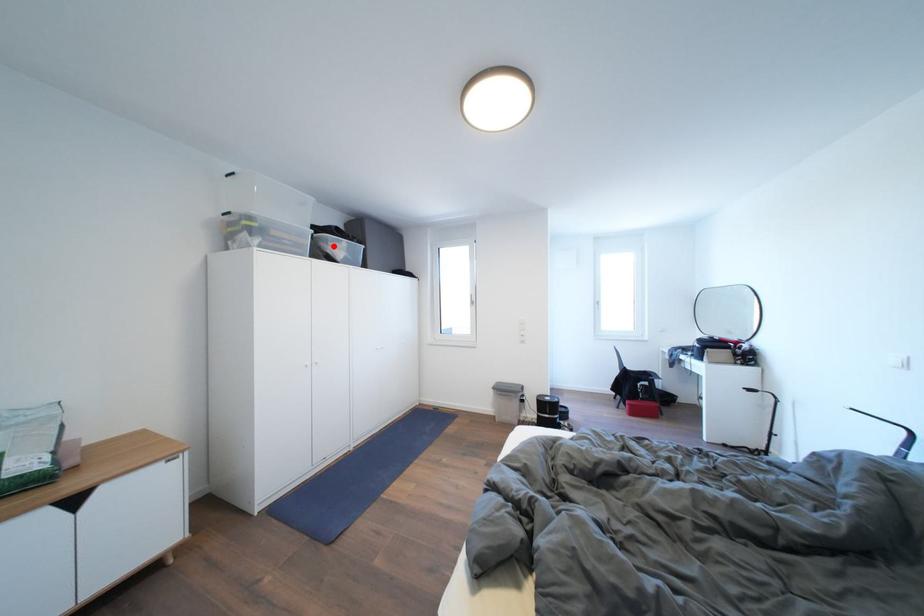
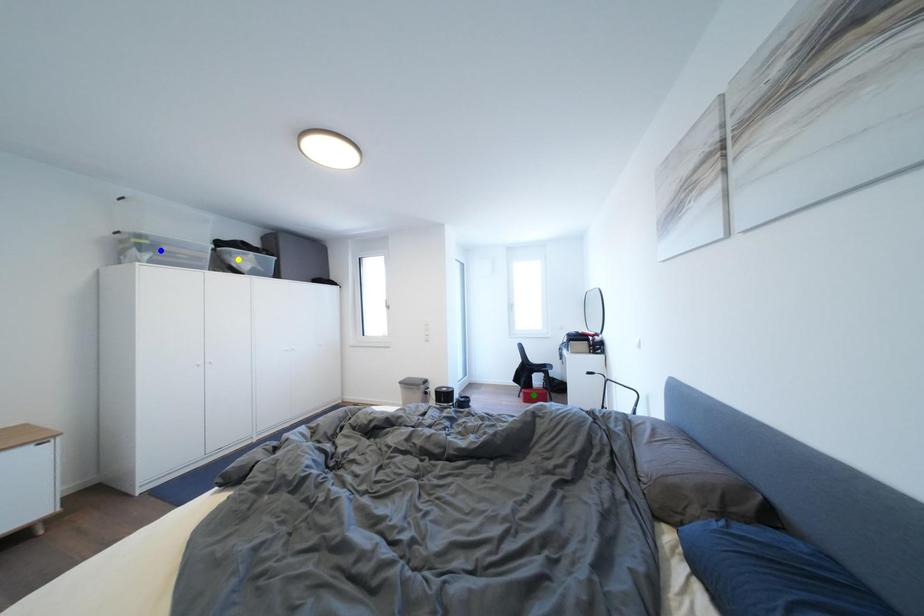
Question: I am providing you with two images of the same scene from different viewpoints. A red point is marked on the first image. You are given multiple points on the second image. Which point in image 2 is actually the same real-world point as the red point in image 1?

Choices:
 (A) blue point
 (B) yellow point
 (C) green point

Answer: (B)